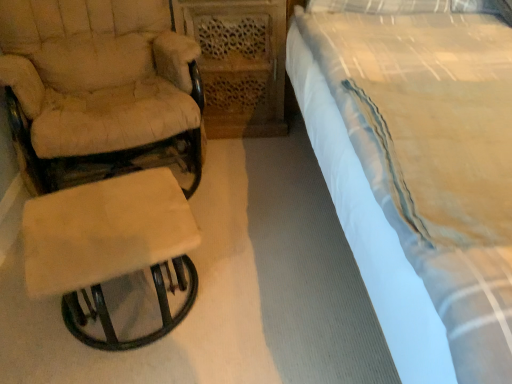
The image size is (512, 384). Find the location of `vacant space that is in between beige fabric chair at left and beige fabric stool at left`. vacant space that is in between beige fabric chair at left and beige fabric stool at left is located at coordinates (x=215, y=256).